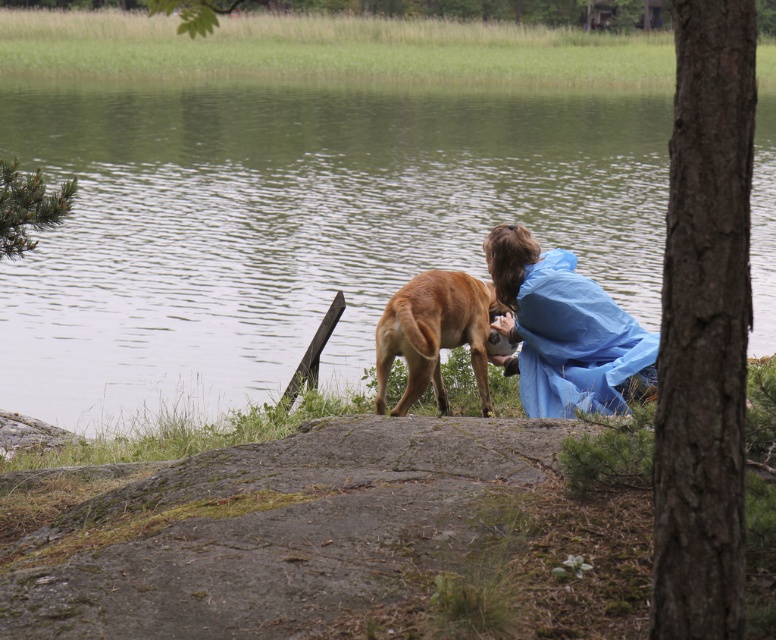
Question: Which point appears farthest from the camera in this image?

Choices:
 (A) (537, 276)
 (B) (459, 314)

Answer: (A)

Question: Does blue waterproof jacket at center appear over brown furry dog at center?

Choices:
 (A) no
 (B) yes

Answer: (A)

Question: Does green water at center come behind blue waterproof jacket at center?

Choices:
 (A) yes
 (B) no

Answer: (B)

Question: Is green water at center further to the viewer compared to brown furry dog at center?

Choices:
 (A) no
 (B) yes

Answer: (A)

Question: Which is farther from the brown furry dog at center?

Choices:
 (A) blue waterproof jacket at center
 (B) green water at center

Answer: (B)

Question: Considering the real-world distances, which object is closest to the green water at center?

Choices:
 (A) brown furry dog at center
 (B) blue waterproof jacket at center

Answer: (B)